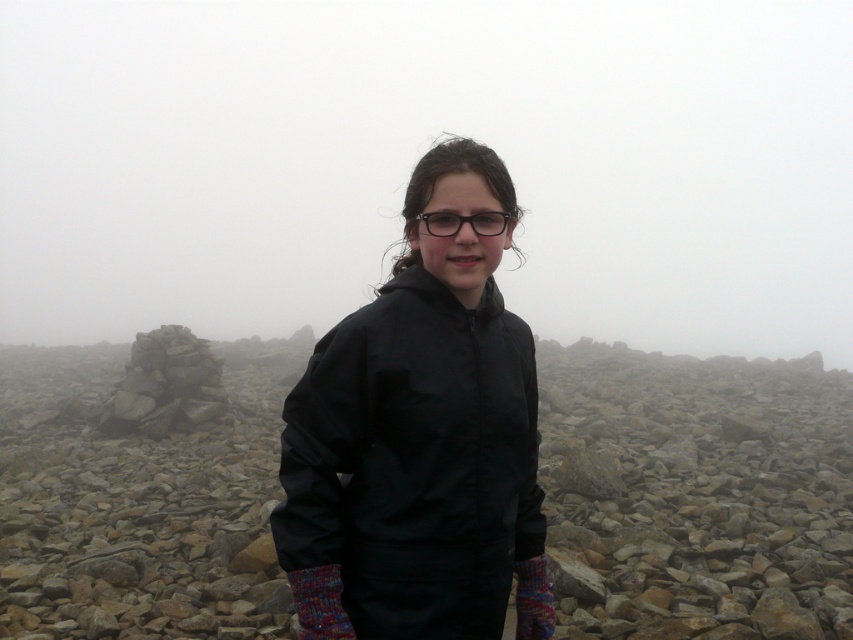
Question: Is the position of black fabric jacket at center more distant than that of black/waterproof jacket at center?

Choices:
 (A) no
 (B) yes

Answer: (B)

Question: Which object appears farthest from the camera in this image?

Choices:
 (A) black/waterproof jacket at center
 (B) transparent plastic glasses at center

Answer: (B)

Question: Is black/waterproof jacket at center to the right of transparent plastic glasses at center from the viewer's perspective?

Choices:
 (A) no
 (B) yes

Answer: (A)

Question: Which point appears closest to the camera in this image?

Choices:
 (A) (471, 220)
 (B) (682, 506)
 (C) (397, 584)

Answer: (C)

Question: Can you confirm if black/waterproof jacket at center is positioned to the right of transparent plastic glasses at center?

Choices:
 (A) yes
 (B) no

Answer: (B)

Question: Which of the following is the farthest from the observer?

Choices:
 (A) (433, 522)
 (B) (259, 467)

Answer: (B)